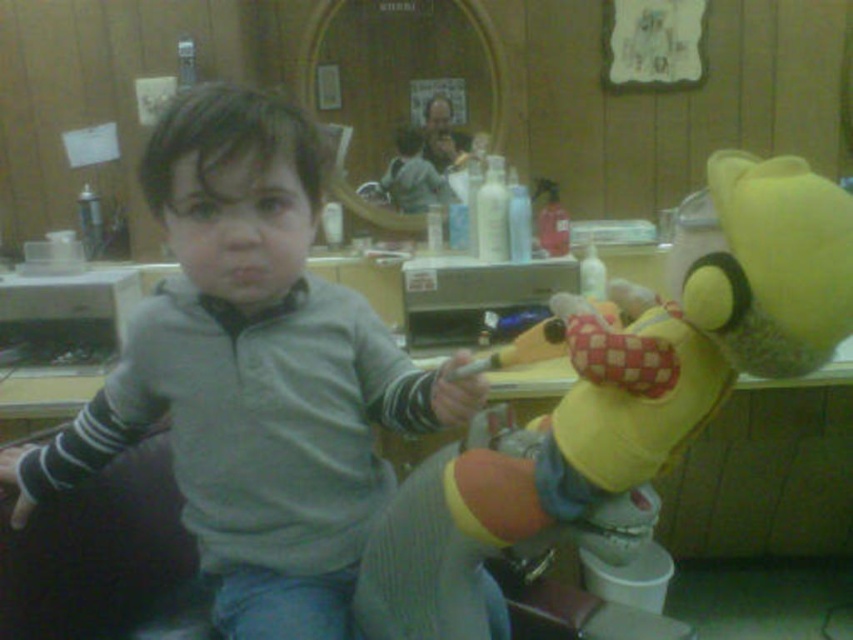
Is yellow plush toy at center thinner than smooth plastic comb at upper center?

In fact, yellow plush toy at center might be wider than smooth plastic comb at upper center.

Is yellow plush toy at center behind smooth plastic comb at upper center?

That is False.

Is point (582, 442) behind point (451, 164)?

That is False.

The width and height of the screenshot is (853, 640). I want to click on yellow plush toy at center, so click(618, 400).